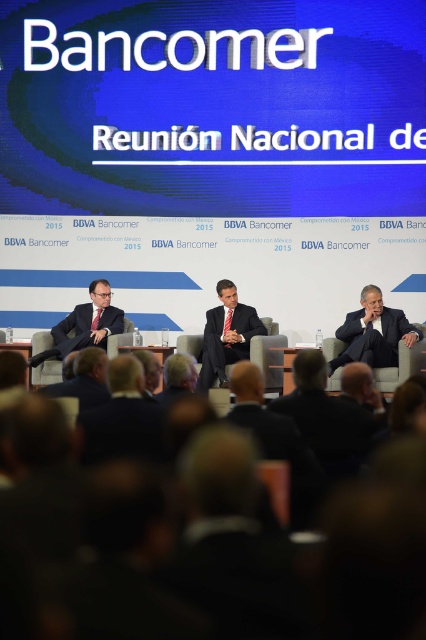
Question: Is matte black suit at center positioned in front of matte black suit at left?

Choices:
 (A) yes
 (B) no

Answer: (A)

Question: Which point appears farthest from the camera in this image?

Choices:
 (A) (256, 310)
 (B) (380, 312)
 (C) (77, 330)

Answer: (A)

Question: Which point is closer to the camera?

Choices:
 (A) matte black suit at center
 (B) matte black suit at right
 (C) matte black suit at left
 (D) dark blue suit at center

Answer: (D)

Question: Considering the real-world distances, which object is closest to the matte black suit at left?

Choices:
 (A) dark blue suit at center
 (B) matte black suit at right
 (C) matte black suit at center

Answer: (C)

Question: Does dark blue suit at center appear on the right side of matte black suit at left?

Choices:
 (A) yes
 (B) no

Answer: (A)

Question: Is matte black suit at center below matte black suit at left?

Choices:
 (A) yes
 (B) no

Answer: (A)